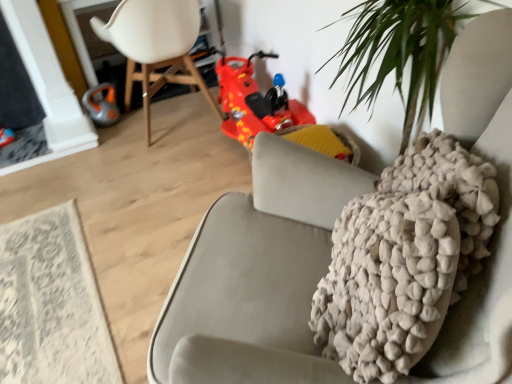
Question: From the image's perspective, would you say orange rubber vacuum cleaner at left is positioned over white plastic chair at upper left?

Choices:
 (A) yes
 (B) no

Answer: (B)

Question: Does orange rubber vacuum cleaner at left turn towards white plastic chair at upper left?

Choices:
 (A) no
 (B) yes

Answer: (B)

Question: From a real-world perspective, does orange rubber vacuum cleaner at left stand above white plastic chair at upper left?

Choices:
 (A) yes
 (B) no

Answer: (B)

Question: Can you confirm if orange rubber vacuum cleaner at left is smaller than white plastic chair at upper left?

Choices:
 (A) no
 (B) yes

Answer: (B)

Question: From the image's perspective, is orange rubber vacuum cleaner at left below white plastic chair at upper left?

Choices:
 (A) no
 (B) yes

Answer: (B)

Question: In terms of width, does shiny red plastic toy car at center look wider or thinner when compared to orange rubber vacuum cleaner at left?

Choices:
 (A) thin
 (B) wide

Answer: (B)

Question: Is shiny red plastic toy car at center bigger or smaller than orange rubber vacuum cleaner at left?

Choices:
 (A) small
 (B) big

Answer: (B)

Question: Relative to orange rubber vacuum cleaner at left, is shiny red plastic toy car at center in front or behind?

Choices:
 (A) behind
 (B) front

Answer: (B)

Question: From the image's perspective, is shiny red plastic toy car at center located above or below orange rubber vacuum cleaner at left?

Choices:
 (A) below
 (B) above

Answer: (A)

Question: Do you think white plastic chair at upper left is within white textured rug at lower left, or outside of it?

Choices:
 (A) inside
 (B) outside

Answer: (B)

Question: Visually, is white plastic chair at upper left positioned to the left or to the right of white textured rug at lower left?

Choices:
 (A) left
 (B) right

Answer: (B)

Question: From their relative heights in the image, would you say white plastic chair at upper left is taller or shorter than white textured rug at lower left?

Choices:
 (A) short
 (B) tall

Answer: (B)

Question: Relative to white textured rug at lower left, is white plastic chair at upper left in front or behind?

Choices:
 (A) front
 (B) behind

Answer: (B)

Question: Based on their positions, is shiny red plastic toy car at center located to the left or right of white plastic chair at upper left?

Choices:
 (A) right
 (B) left

Answer: (A)

Question: From the image's perspective, is shiny red plastic toy car at center positioned above or below white plastic chair at upper left?

Choices:
 (A) above
 (B) below

Answer: (B)